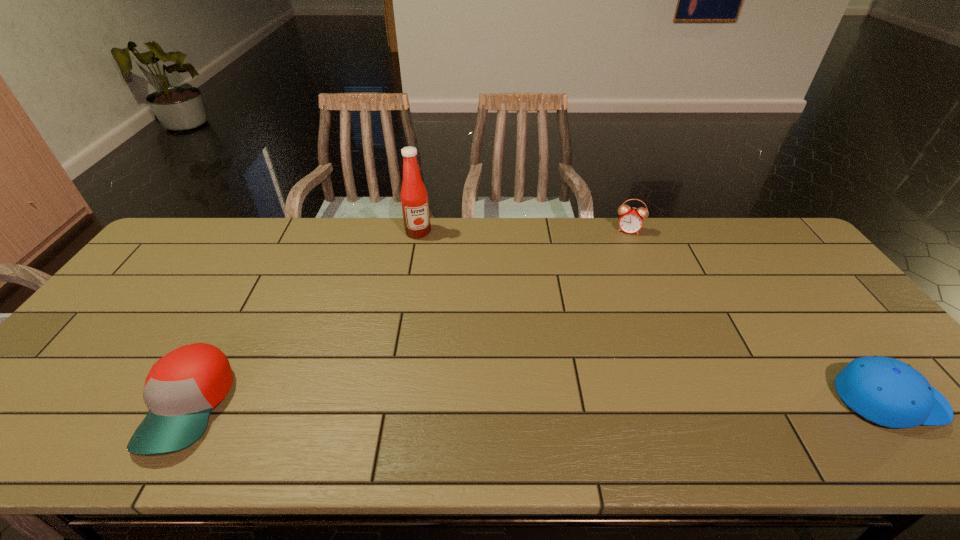
Identify the location of free spot between the second object from left to right and the alarm clock. The height and width of the screenshot is (540, 960). (523, 231).

The image size is (960, 540). Identify the location of free space that is in between the alarm clock and the condiment. (523, 231).

The image size is (960, 540). Identify the location of object identified as the second closest to the second object from right to left. (414, 199).

Where is `object that is the closest to the tallest object`? object that is the closest to the tallest object is located at coordinates (182, 388).